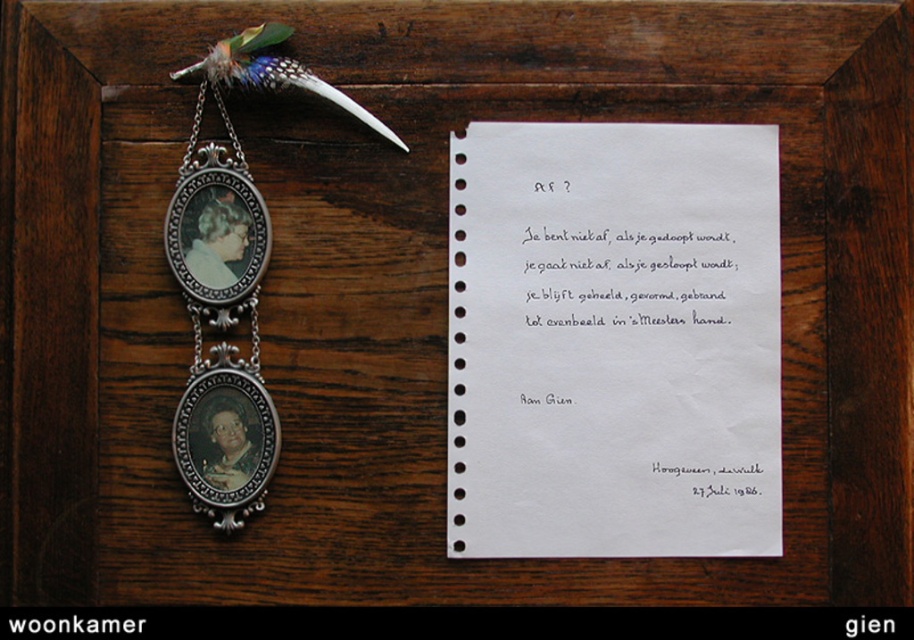
Which of these two, white paper at center or silver/metallic pendant at left, stands taller?

silver/metallic pendant at left

Who is more forward, (453, 342) or (222, 196)?

Point (222, 196) is more forward.

Which is in front, point (721, 230) or point (186, 182)?

Point (186, 182)

Identify the location of white paper at center. This screenshot has width=914, height=640. (613, 340).